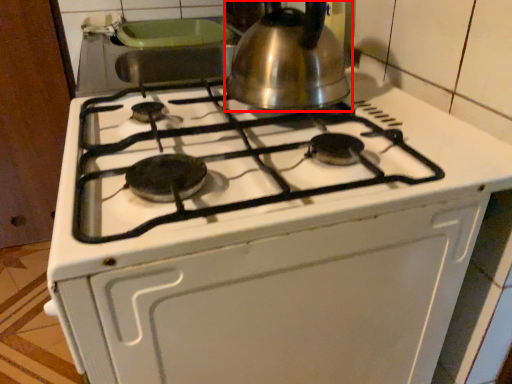
Question: From the image's perspective, where is kettle (annotated by the red box) located in relation to oven in the image?

Choices:
 (A) above
 (B) below

Answer: (A)